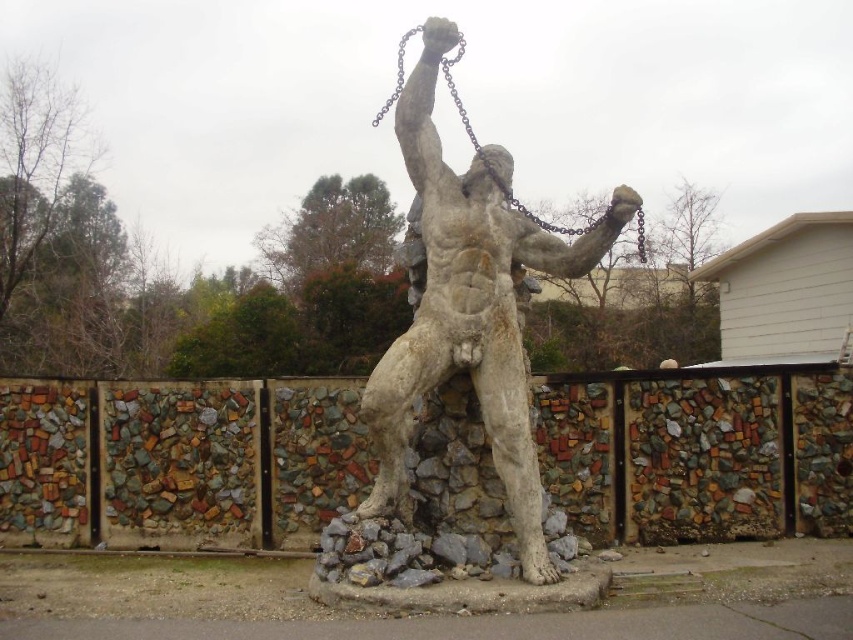
You are an art student analyzing the statue and its surroundings. The coordinates given correspond to a specific feature in the image. Which object is located at the coordinates point (178,460)?

The point (178,460) indicates the stained glass mosaic fence at center.

You are an art student analyzing the statue and its surroundings. Based on the scene, where is the stained glass mosaic fence at center in relation to the dark gray metallic chain at upper center?

The stained glass mosaic fence at center is located below the dark gray metallic chain at upper center.